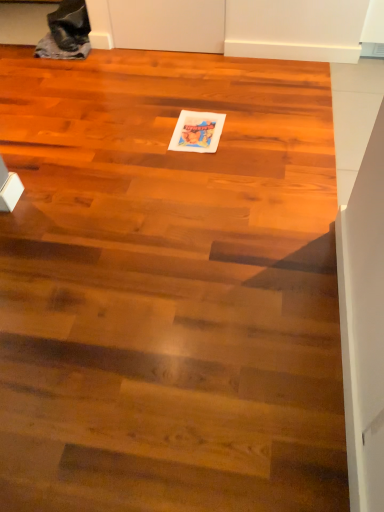
Locate an element on the screen. white paper at center is located at coordinates (197, 132).

The image size is (384, 512). What do you see at coordinates (197, 132) in the screenshot?
I see `white paper at center` at bounding box center [197, 132].

Locate an element on the screen. Image resolution: width=384 pixels, height=512 pixels. white paper at center is located at coordinates click(197, 132).